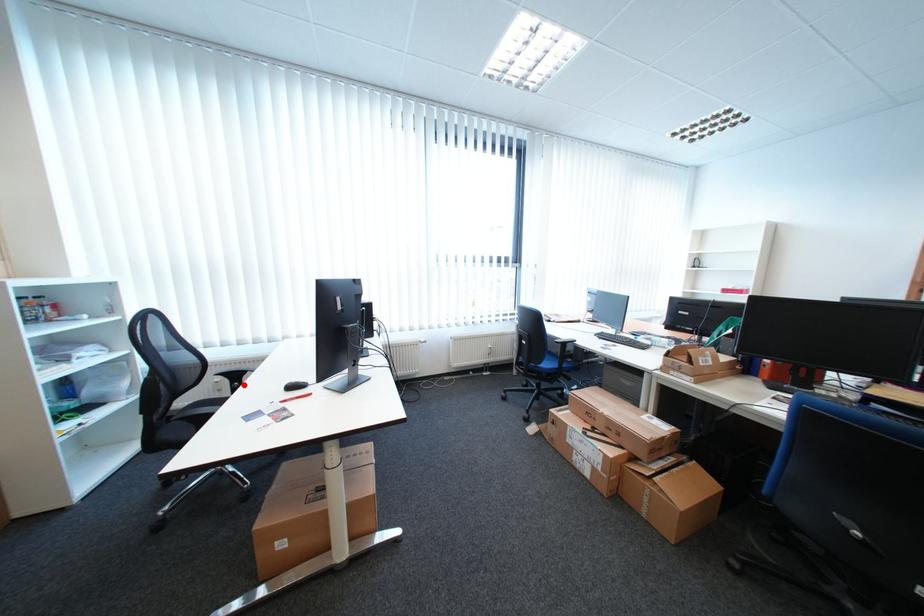
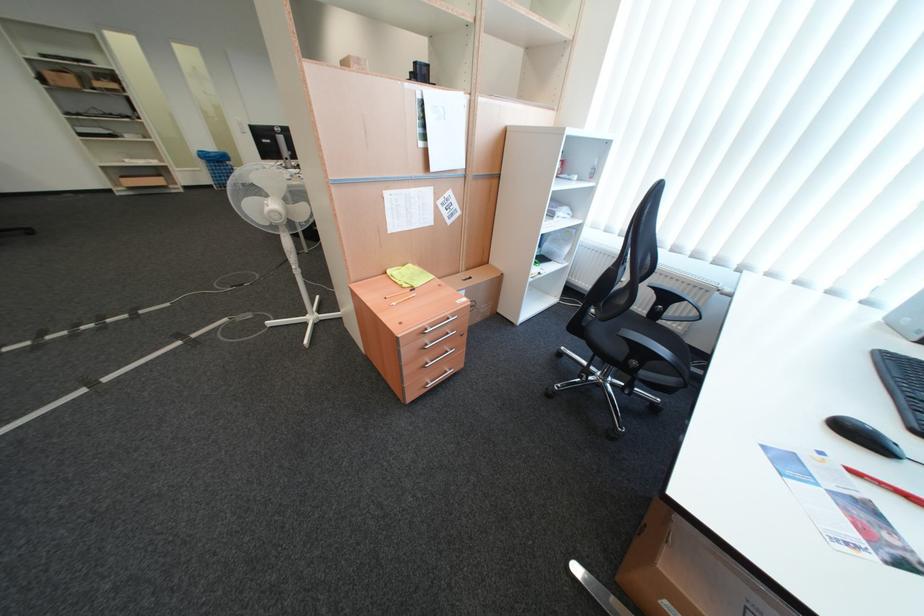
Question: I am providing you with two images of the same scene from different viewpoints. In image1, a red point is highlighted. Considering the same 3D point in image2, which of the following is correct?

Choices:
 (A) It is closer
 (B) It is farther

Answer: (A)